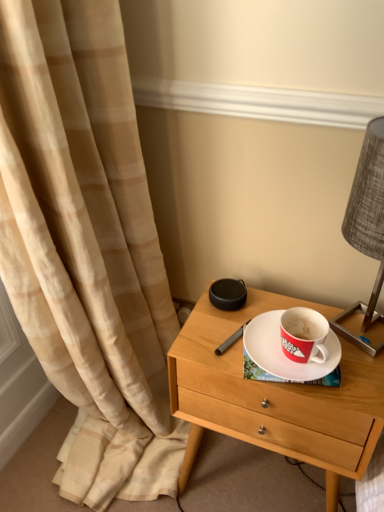
Where is `blank space above white matte saucer at center (from a real-world perspective)`? blank space above white matte saucer at center (from a real-world perspective) is located at coordinates (286, 347).